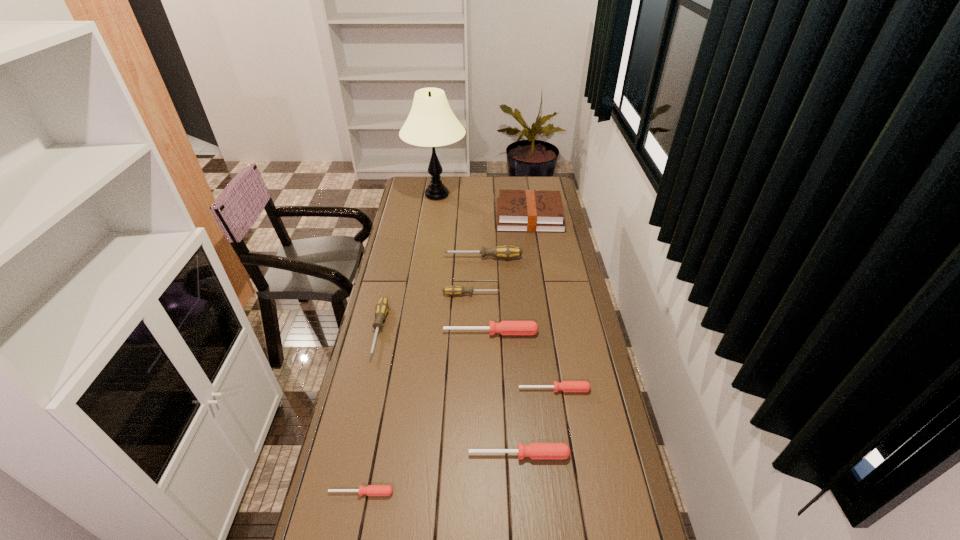
You are a GUI agent. You are given a task and a screenshot of the screen. Output one action in this format:
    pyautogui.click(x=<x>, y=<y>)
    Task: Click on the third farthest red screwdriver
    
    Given the screenshot: What is the action you would take?
    click(534, 450)

This screenshot has height=540, width=960. In order to click on the eighth farthest object in this screenshot , I will do `click(534, 450)`.

This screenshot has width=960, height=540. Identify the location of the eighth tallest object. (566, 386).

Identify the location of the third nearest red screwdriver. This screenshot has height=540, width=960. (566, 386).

Locate an element on the screen. the nearest screwdriver is located at coordinates (371, 490).

The image size is (960, 540). In order to click on the nearest object in this screenshot , I will do [x=371, y=490].

At what (x,y) coordinates should I click in order to perform the action: click on blank space located on the right of the black lamp. Please return your answer as a coordinate pair (x, y). The height and width of the screenshot is (540, 960). Looking at the image, I should click on (497, 195).

Image resolution: width=960 pixels, height=540 pixels. What are the coordinates of `free region located 0.100m on the left of the second tallest object` in the screenshot? It's located at [476, 217].

You are a GUI agent. You are given a task and a screenshot of the screen. Output one action in this format:
    pyautogui.click(x=<x>, y=<y>)
    Task: Click on the free space located at the tip of the farthest gray screwdriver
    This screenshot has width=960, height=540.
    Given the screenshot: What is the action you would take?
    pyautogui.click(x=406, y=258)

At what (x,y) coordinates should I click in order to perform the action: click on free space located 0.240m at the tip of the farthest gray screwdriver. Please return your answer as a coordinate pair (x, y). Image resolution: width=960 pixels, height=540 pixels. Looking at the image, I should click on (392, 258).